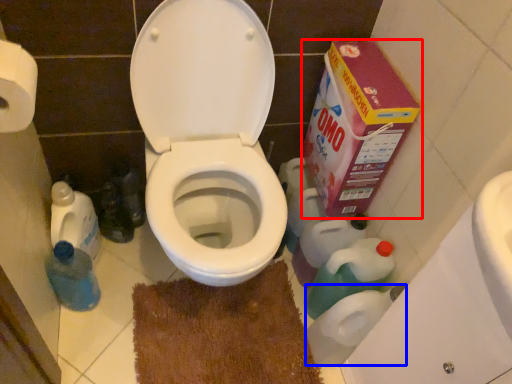
Question: Which object is further to the camera taking this photo, cardboard box (highlighted by a red box) or toilet paper (highlighted by a blue box)?

Choices:
 (A) cardboard box
 (B) toilet paper

Answer: (B)